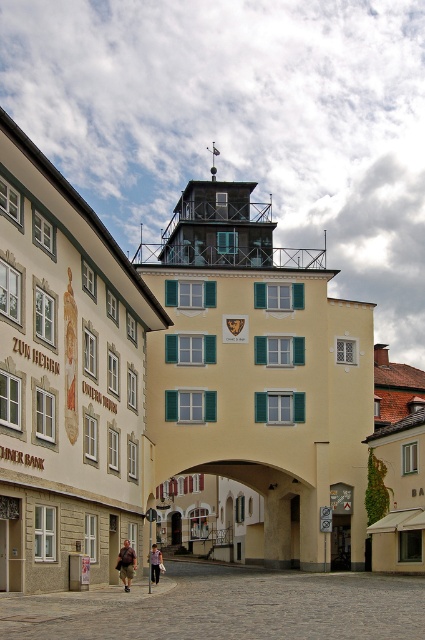
Question: Is matte black tower at upper center to the left of light brown leather jacket at lower center from the viewer's perspective?

Choices:
 (A) no
 (B) yes

Answer: (A)

Question: Is the position of brown leather jacket at lower center more distant than that of light brown leather jacket at lower center?

Choices:
 (A) no
 (B) yes

Answer: (A)

Question: Among these points, which one is nearest to the camera?

Choices:
 (A) (127, 548)
 (B) (206, 220)

Answer: (A)

Question: Which point is closer to the camera taking this photo?

Choices:
 (A) (156, 563)
 (B) (169, 468)
 (C) (124, 561)

Answer: (C)

Question: Which point is closer to the camera?

Choices:
 (A) light brown leather jacket at lower center
 (B) brown leather jacket at lower center

Answer: (B)

Question: Is matte black tower at upper center thinner than brown leather jacket at lower center?

Choices:
 (A) yes
 (B) no

Answer: (B)